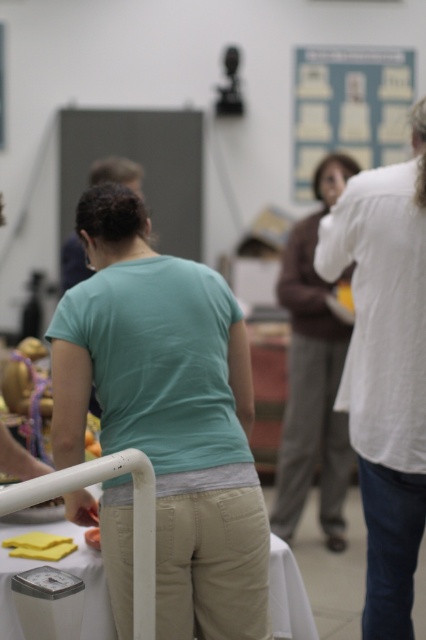
Does point (5, 572) come farther from viewer compared to point (331, 118)?

No.

Based on the photo, is white plastic table at center further to camera compared to blue paperboard at upper center?

No.

Which is in front, point (284, 592) or point (322, 147)?

Positioned in front is point (284, 592).

Where is `white plastic table at center`? The height and width of the screenshot is (640, 426). white plastic table at center is located at coordinates click(134, 515).

Does point (150, 337) come behind point (351, 269)?

No, it is in front of (351, 269).

You are a GUI agent. You are given a task and a screenshot of the screen. Output one action in this format:
    pyautogui.click(x=<x>, y=<y>)
    Task: Click on the teal matte shirt at center
    This screenshot has width=426, height=640.
    Given the screenshot: What is the action you would take?
    pyautogui.click(x=167, y=412)

Is point (307, 292) positioned after point (311, 172)?

No, (307, 292) is in front of (311, 172).

Can you confirm if matte brown sweater at center is shorter than blue paperboard at upper center?

Incorrect, matte brown sweater at center's height does not fall short of blue paperboard at upper center's.

In order to click on matte brown sweater at center in this screenshot , I will do `click(313, 376)`.